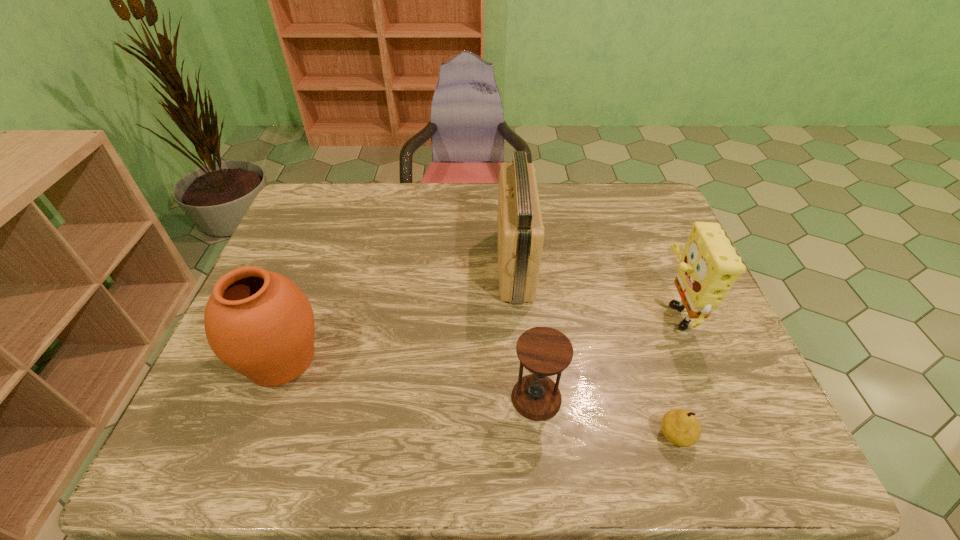
I want to click on the third closest object to the radio receiver, so click(x=680, y=427).

The image size is (960, 540). Identify the location of object that stands as the closest to the radio receiver. (543, 351).

At what (x,y) coordinates should I click in order to perform the action: click on free space that satisfies the following two spatial constraints: 1. on the front-facing side of the hourglass; 2. on the right side of the radio receiver. Please return your answer as a coordinate pair (x, y). The image size is (960, 540). Looking at the image, I should click on (526, 397).

Identify the location of free space that satisfies the following two spatial constraints: 1. on the back side of the pear; 2. on the front-facing side of the radio receiver. Image resolution: width=960 pixels, height=540 pixels. [620, 265].

Locate an element on the screen. free space that satisfies the following two spatial constraints: 1. on the front side of the shortest object; 2. on the right side of the urn is located at coordinates (252, 436).

Where is `vacant area that satisfies the following two spatial constraints: 1. on the front side of the fourth object from left to right; 2. on the right side of the urn`? vacant area that satisfies the following two spatial constraints: 1. on the front side of the fourth object from left to right; 2. on the right side of the urn is located at coordinates (252, 436).

This screenshot has height=540, width=960. What are the coordinates of `blank space that satisfies the following two spatial constraints: 1. on the face of the rightmost object; 2. on the front side of the fourth object from left to right` in the screenshot? It's located at (724, 436).

At what (x,y) coordinates should I click in order to perform the action: click on vacant point that satisfies the following two spatial constraints: 1. on the front side of the urn; 2. on the left side of the hourglass. Please return your answer as a coordinate pair (x, y). This screenshot has width=960, height=540. Looking at the image, I should click on (266, 397).